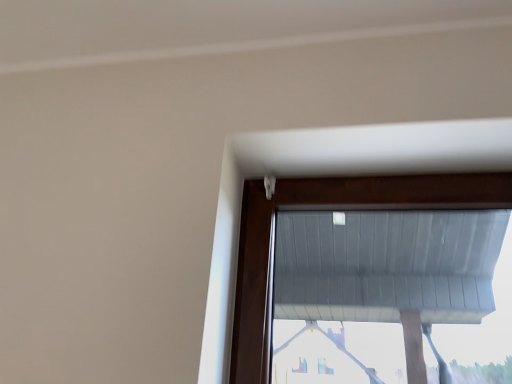
The height and width of the screenshot is (384, 512). Find the location of `matte gray roller blind at upper center`. matte gray roller blind at upper center is located at coordinates (329, 205).

This screenshot has height=384, width=512. Describe the element at coordinates (329, 205) in the screenshot. I see `matte gray roller blind at upper center` at that location.

Locate an element on the screen. This screenshot has width=512, height=384. matte gray roller blind at upper center is located at coordinates (329, 205).